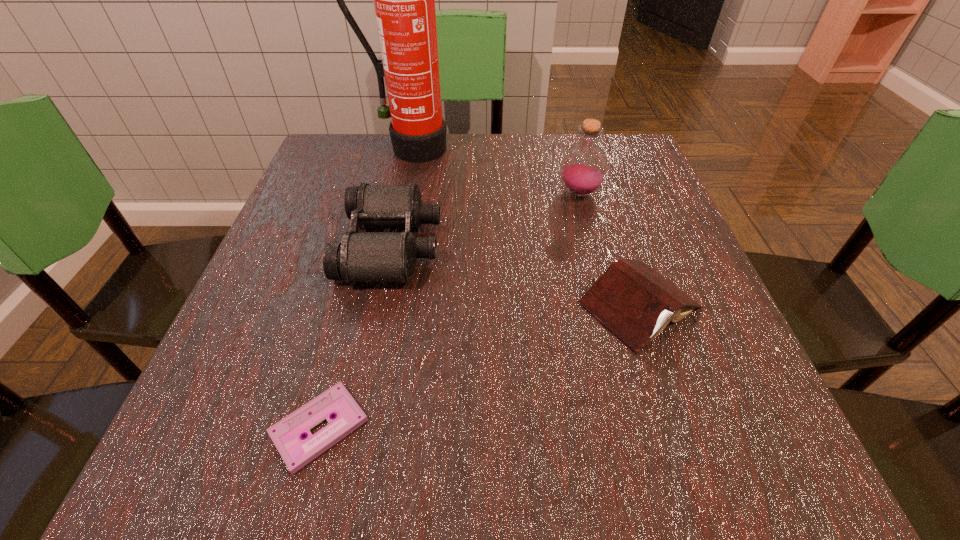
In order to click on vacant point located on the back of the book in this screenshot , I will do `click(594, 167)`.

Identify the location of vacant space located 0.400m on the right of the videotape. (672, 427).

At what (x,y) coordinates should I click in order to perform the action: click on fire extinguisher present at the far edge. Please return your answer as a coordinate pair (x, y). Image resolution: width=960 pixels, height=540 pixels. Looking at the image, I should click on click(404, 0).

At what (x,y) coordinates should I click in order to perform the action: click on bottle present at the far edge. Please return your answer as a coordinate pair (x, y). This screenshot has width=960, height=540. Looking at the image, I should click on (583, 168).

Find the location of a particular element. The width and height of the screenshot is (960, 540). object positioned at the near edge is located at coordinates (287, 434).

The width and height of the screenshot is (960, 540). In order to click on fire extinguisher present at the left edge in this screenshot , I will do `click(404, 0)`.

Locate an element on the screen. The width and height of the screenshot is (960, 540). binoculars that is positioned at the left edge is located at coordinates (361, 256).

Where is `videotape located in the left edge section of the desktop`? The height and width of the screenshot is (540, 960). videotape located in the left edge section of the desktop is located at coordinates (287, 434).

The width and height of the screenshot is (960, 540). I want to click on bottle present at the right edge, so click(583, 168).

This screenshot has height=540, width=960. I want to click on book positioned at the right edge, so (635, 302).